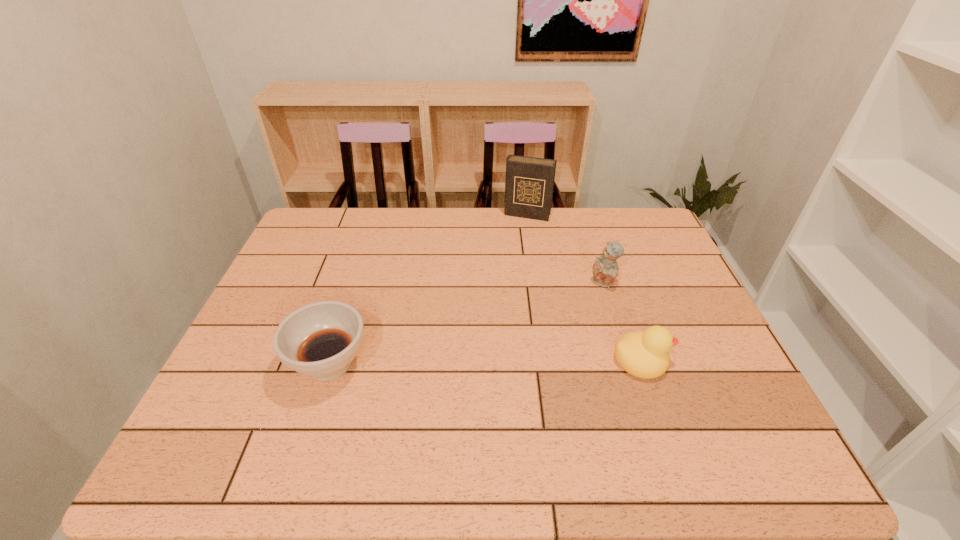
The height and width of the screenshot is (540, 960). I want to click on vacant space on the desktop that is between the soup bowl and the duckling and is positioned on the front cover of the diary, so click(478, 361).

Where is `vacant space on the desktop that is between the leftmost object and the duckling and is positioned on the front-facing side of the teddy bear`? vacant space on the desktop that is between the leftmost object and the duckling and is positioned on the front-facing side of the teddy bear is located at coordinates coord(493,361).